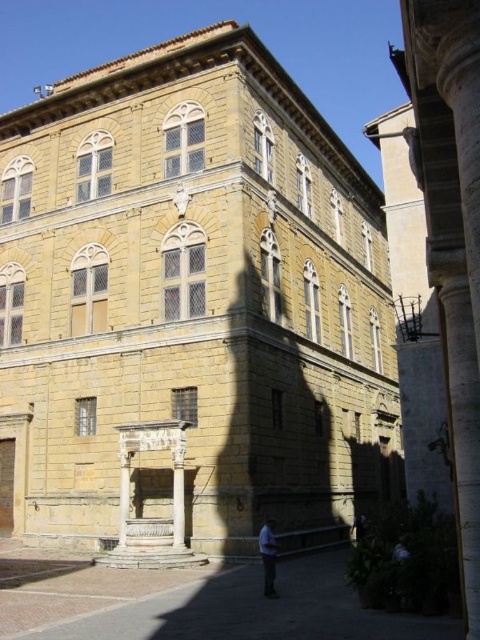
You are standing in front of the historic building and want to take a photo of the blue fabric shirt at lower center without the smooth stone pillar at right appearing in the frame. Is this possible given their positions?

The smooth stone pillar at right is located above the blue fabric shirt at lower center, so if you position yourself lower or adjust your angle to avoid the pillar above, it should be possible to capture the shirt without the pillar in the frame.

You are standing in front of the historic building and want to determine the relative positions of two points marked on the structure. Which point, point (456,289) or point (267,550), is closer to you?

Point (456,289) is closer to the viewer than point (267,550).